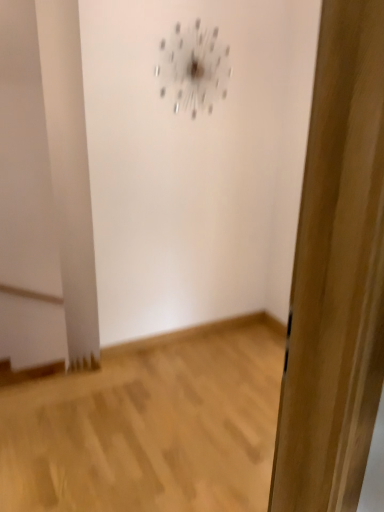
The image size is (384, 512). Describe the element at coordinates (193, 68) in the screenshot. I see `metallic silver clock at upper center` at that location.

Image resolution: width=384 pixels, height=512 pixels. I want to click on metallic silver clock at upper center, so click(193, 68).

Find the location of a particular element. This screenshot has height=512, width=384. metallic silver clock at upper center is located at coordinates (193, 68).